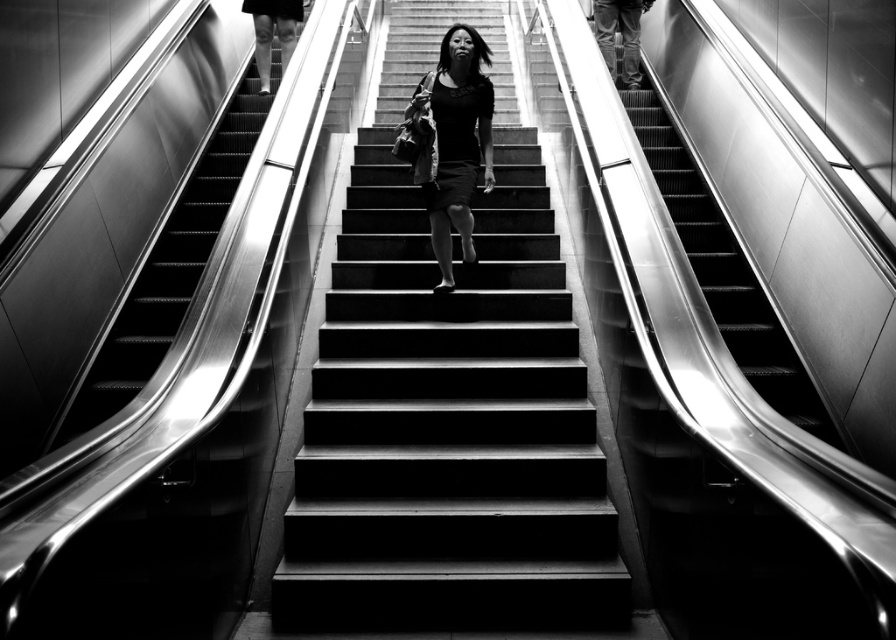
Based on the photo, you are a photographer standing at the subway station. You want to take a photo of the metallic escalator at left and the black matte dress at center. Based on their positions, which object will appear closer to the camera in the photo?

The metallic escalator at left is in front of the black matte dress at center, so it will appear closer to the camera in the photo.

Looking at this image, you are a photographer standing at the subway station. You want to capture a photo of the smooth concrete stairs at center and the metallic escalator at left. According to the scene description, which object is positioned to the right of the other?

The smooth concrete stairs at center is positioned to the right of the metallic escalator at left.